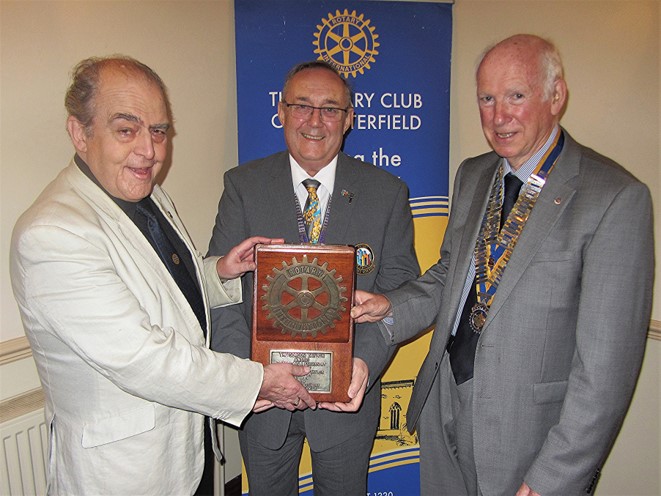
Identify the location of wall hanging. The width and height of the screenshot is (661, 496). tap(264, 28).